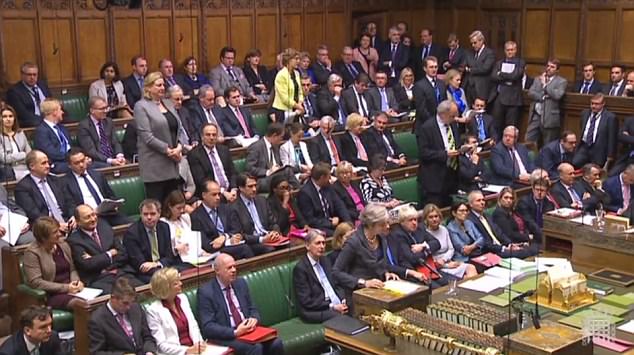
This screenshot has height=355, width=634. I want to click on central table, so pos(524,302).